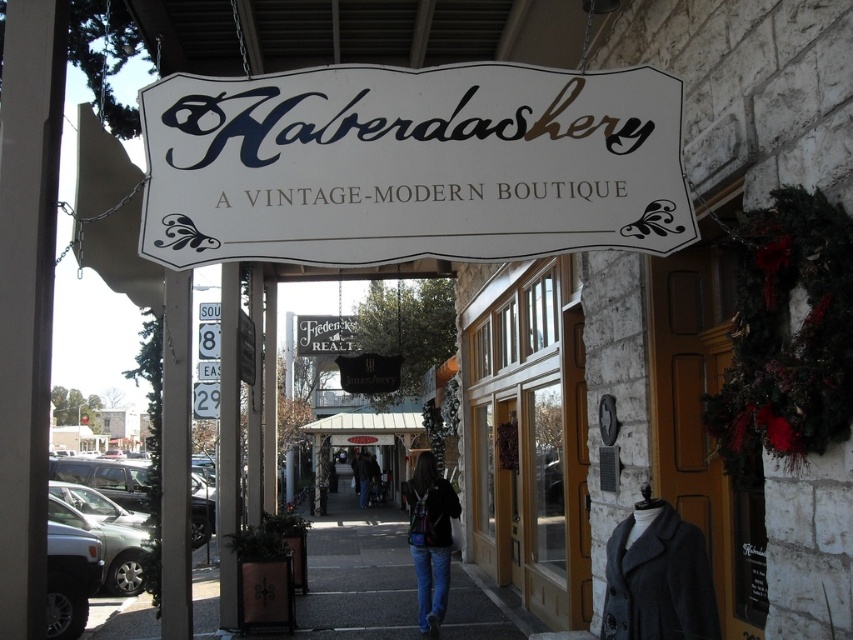
You are standing outside the Haberdashery entrance and notice two points marked on the wall. The first point is at coordinate point (142, 616) and the second is at point (360, 499). Which point is closer to you?

Point (142, 616) is in front of point (360, 499), so it is closer to you.

You are standing at the entrance of the Haberdashery boutique and notice two points marked on the building. The first point is at coordinates point (x=643, y=67) and the second is at point (x=335, y=516). Which point is closer to you?

Point (x=643, y=67) is closer to the viewer than point (x=335, y=516).